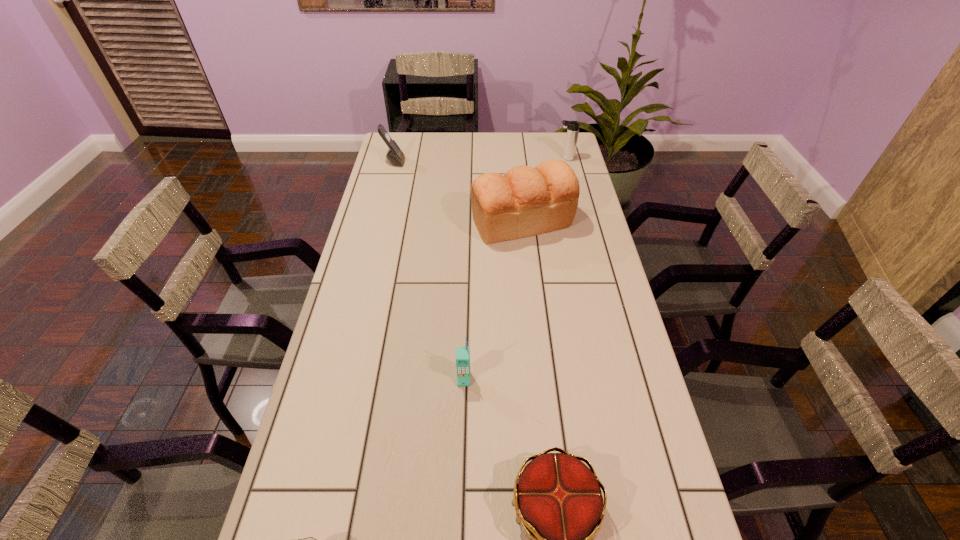
At what (x,y) coordinates should I click in order to perform the action: click on blank space located 0.050m on the front-facing side of the left cellular telephone. Please return your answer as a coordinate pair (x, y). The height and width of the screenshot is (540, 960). Looking at the image, I should click on (417, 162).

I want to click on vacant region located 0.090m on the keypad of the right cellular telephone, so click(463, 421).

The image size is (960, 540). I want to click on thermos bottle that is at the far edge, so click(573, 126).

Locate an element on the screen. cellular telephone that is at the far edge is located at coordinates tap(394, 155).

The image size is (960, 540). What are the coordinates of `object at the left edge` in the screenshot? It's located at (394, 155).

At what (x,y) coordinates should I click in order to perform the action: click on bread that is at the right edge. Please return your answer as a coordinate pair (x, y). This screenshot has width=960, height=540. Looking at the image, I should click on (526, 201).

In order to click on thermos bottle that is at the right edge in this screenshot , I will do `click(573, 126)`.

The height and width of the screenshot is (540, 960). I want to click on object at the far left corner, so click(394, 155).

Find the location of a particular element. The width and height of the screenshot is (960, 540). object present at the far right corner is located at coordinates (573, 126).

Locate an element on the screen. The image size is (960, 540). free region at the far edge is located at coordinates (522, 138).